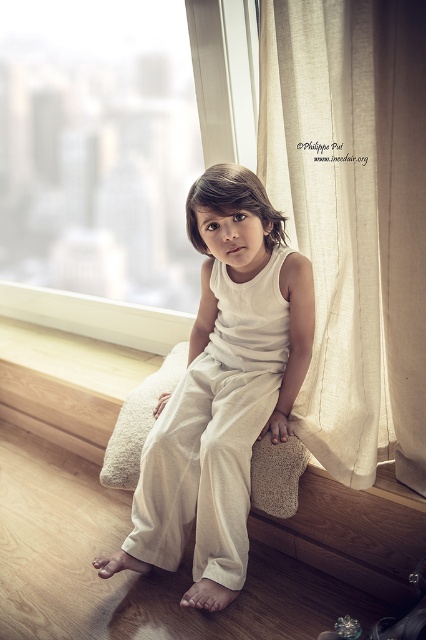
The child is sitting on the window sill. There is a point labeled as point (115, 156). Where is this point located?

The point (115, 156) is located on the transparent glass window at center.

You are a photographer trying to capture the child in the image. The child is sitting on the window sill with the transparent glass window at center and white cotton pants at center visible. To ensure the background is blurred, you need to focus on the subject while keeping the window in frame. Which object should you position closer to the camera lens to achieve the desired effect?

You should position the transparent glass window at center closer to the camera lens because it is to the left of the white cotton pants at center, so moving it closer would help blur the background while keeping the subject in focus.